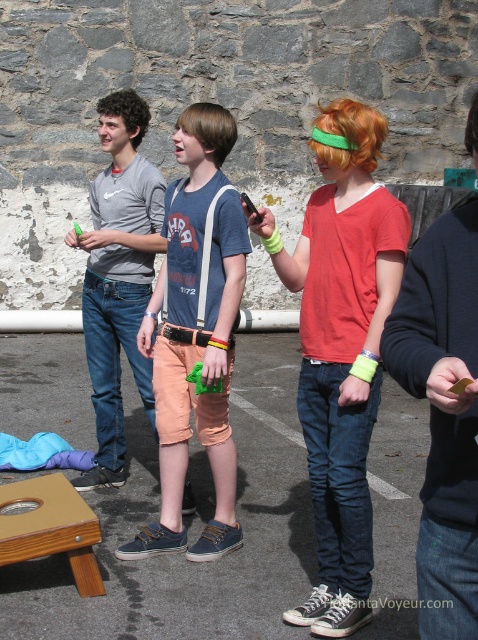
Question: Among these objects, which one is farthest from the camera?

Choices:
 (A) wooden stool at lower left
 (B) dark blue sweatshirt at right
 (C) matte gray t-shirt at center

Answer: (C)

Question: Is denim shorts at center below matte gray t-shirt at center?

Choices:
 (A) no
 (B) yes

Answer: (B)

Question: Is concrete parking lot at center to the left of denim shorts at center from the viewer's perspective?

Choices:
 (A) yes
 (B) no

Answer: (A)

Question: Which point is closer to the camera taking this photo?

Choices:
 (A) (162, 374)
 (B) (49, 481)
 (C) (329, 276)
 (D) (434, 330)

Answer: (D)

Question: Which is farther from the matte red t-shirt at center?

Choices:
 (A) concrete parking lot at center
 (B) dark blue sweatshirt at right

Answer: (A)

Question: Does concrete parking lot at center appear over matte red t-shirt at center?

Choices:
 (A) yes
 (B) no

Answer: (B)